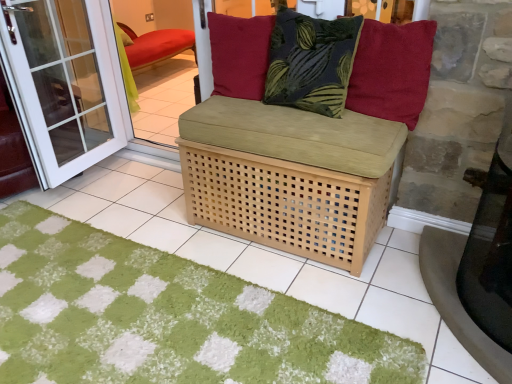
The width and height of the screenshot is (512, 384). Find the location of `free spot above natural wood basket at center (from a real-world perspective)`. free spot above natural wood basket at center (from a real-world perspective) is located at coordinates (268, 108).